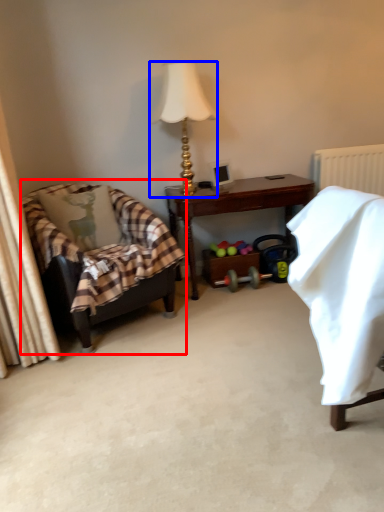
Question: Which of the following is the closest to the observer, chair (highlighted by a red box) or lamp (highlighted by a blue box)?

Choices:
 (A) chair
 (B) lamp

Answer: (A)